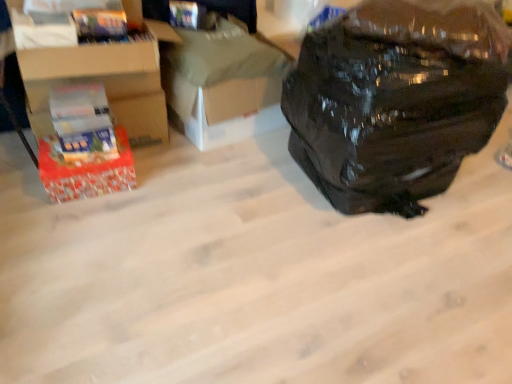
Find the location of a particular element. free space in front of red cardboard box at left is located at coordinates (74, 224).